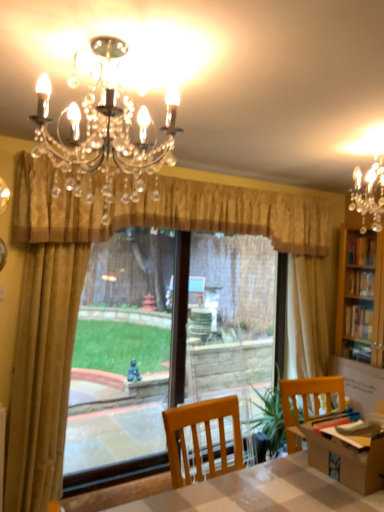
Question: Does translucent plastic screen door at center lie behind gold fabric curtain at left, placed as the second curtain when sorted from right to left?

Choices:
 (A) yes
 (B) no

Answer: (A)

Question: From the image's perspective, is translucent plastic screen door at center located beneath gold fabric curtain at left, placed as the second curtain when sorted from right to left?

Choices:
 (A) no
 (B) yes

Answer: (B)

Question: Can you confirm if translucent plastic screen door at center is wider than gold fabric curtain at left, placed as the second curtain when sorted from right to left?

Choices:
 (A) no
 (B) yes

Answer: (A)

Question: Are translucent plastic screen door at center and gold fabric curtain at left, the 1th curtain from the left, making contact?

Choices:
 (A) no
 (B) yes

Answer: (A)

Question: Is translucent plastic screen door at center not within gold fabric curtain at left, the 1th curtain from the left?

Choices:
 (A) no
 (B) yes

Answer: (B)

Question: Is translucent plastic screen door at center in front of gold fabric curtain at left, placed as the second curtain when sorted from right to left?

Choices:
 (A) no
 (B) yes

Answer: (A)

Question: From the image's perspective, is smooth white table at center above gold textured valance at center, the 2th curtain when ordered from left to right?

Choices:
 (A) yes
 (B) no

Answer: (B)

Question: Does smooth white table at center have a lesser width compared to gold textured valance at center, the 2th curtain when ordered from left to right?

Choices:
 (A) yes
 (B) no

Answer: (B)

Question: Does smooth white table at center have a larger size compared to gold textured valance at center, which is counted as the 1th curtain, starting from the right?

Choices:
 (A) no
 (B) yes

Answer: (B)

Question: From a real-world perspective, is smooth white table at center located higher than gold textured valance at center, which is counted as the 1th curtain, starting from the right?

Choices:
 (A) yes
 (B) no

Answer: (B)

Question: Can you confirm if smooth white table at center is shorter than gold textured valance at center, the 2th curtain when ordered from left to right?

Choices:
 (A) no
 (B) yes

Answer: (A)

Question: Considering the relative sizes of smooth white table at center and gold textured valance at center, the 2th curtain when ordered from left to right, in the image provided, is smooth white table at center wider than gold textured valance at center, the 2th curtain when ordered from left to right,?

Choices:
 (A) yes
 (B) no

Answer: (A)

Question: Is matte black chandelier at upper center shorter than gold fabric curtain at left, placed as the second curtain when sorted from right to left?

Choices:
 (A) no
 (B) yes

Answer: (B)